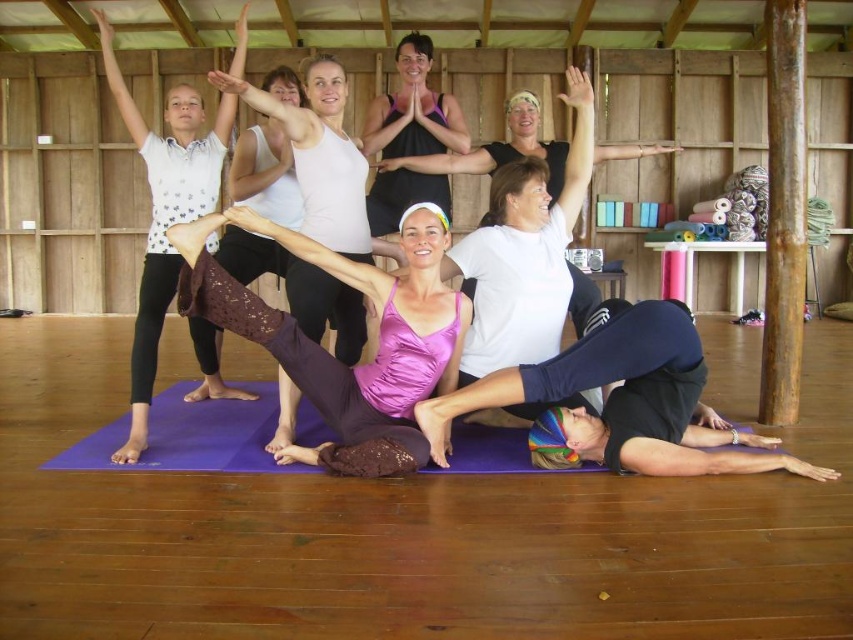
Can you confirm if white dotted tank top at upper left is taller than purple lace leggings at center?

A: Yes, white dotted tank top at upper left is taller than purple lace leggings at center.

Who is taller, white dotted tank top at upper left or purple lace leggings at center?

Standing taller between the two is white dotted tank top at upper left.

Does point (149, 266) come closer to viewer compared to point (279, 108)?

No, (149, 266) is further to viewer.

What are the coordinates of `white dotted tank top at upper left` in the screenshot? It's located at point(164,212).